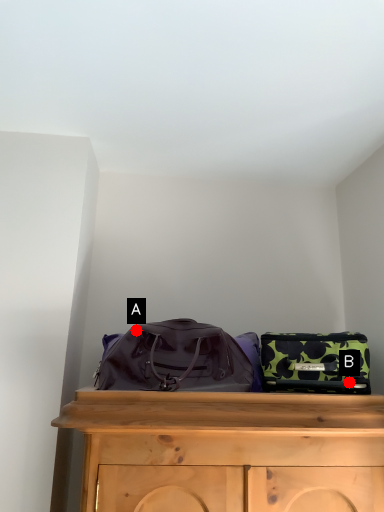
Question: Two points are circled on the image, labeled by A and B beside each circle. Among these points, which one is nearest to the camera?

Choices:
 (A) A is closer
 (B) B is closer

Answer: (B)